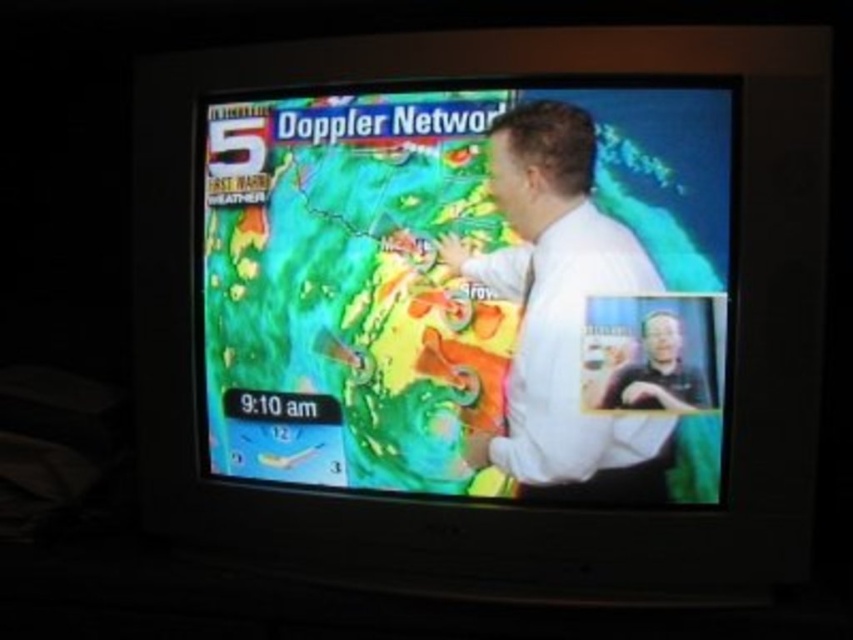
Question: Which object is farther from the camera taking this photo?

Choices:
 (A) rainbow-colored weather map at center
 (B) white smooth shirt at center

Answer: (B)

Question: Which point is farther to the camera?

Choices:
 (A) (618, 182)
 (B) (576, 180)

Answer: (B)

Question: Can you confirm if rainbow-colored weather map at center is positioned to the left of white smooth shirt at center?

Choices:
 (A) no
 (B) yes

Answer: (B)

Question: In this image, where is rainbow-colored weather map at center located relative to white smooth shirt at center?

Choices:
 (A) right
 (B) left

Answer: (B)

Question: Which point is farther from the camera taking this photo?

Choices:
 (A) (370, 440)
 (B) (563, 497)

Answer: (A)

Question: Is rainbow-colored weather map at center above white smooth shirt at center?

Choices:
 (A) no
 (B) yes

Answer: (B)